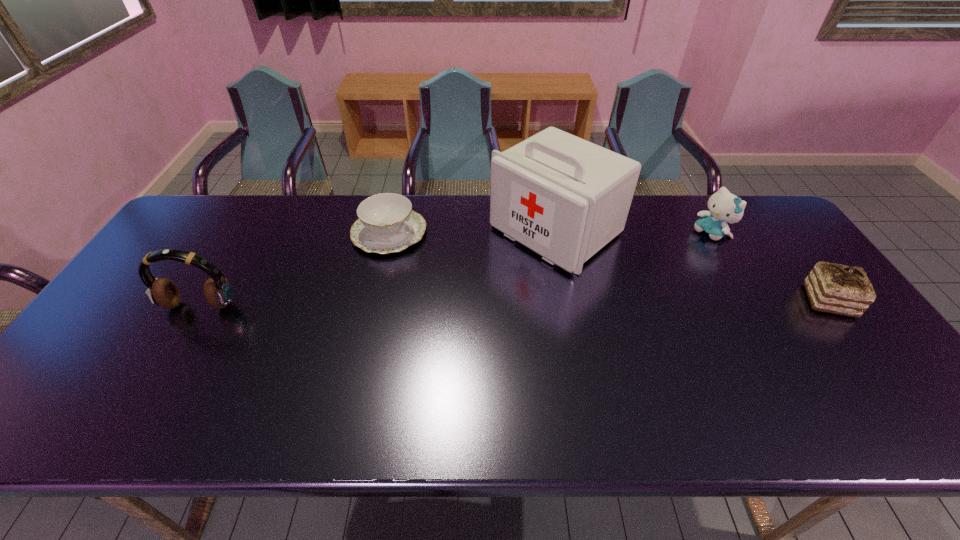
Choose which object is the second nearest neighbor to the headset. Please provide its 2D coordinates. Your answer should be formatted as a tuple, i.e. [(x, y)], where the tuple contains the x and y coordinates of a point satisfying the conditions above.

[(565, 198)]

Image resolution: width=960 pixels, height=540 pixels. In order to click on free space that satisfies the following two spatial constraints: 1. on the back side of the third object from right to left; 2. on the left side of the chinaware in this screenshot , I will do `click(390, 231)`.